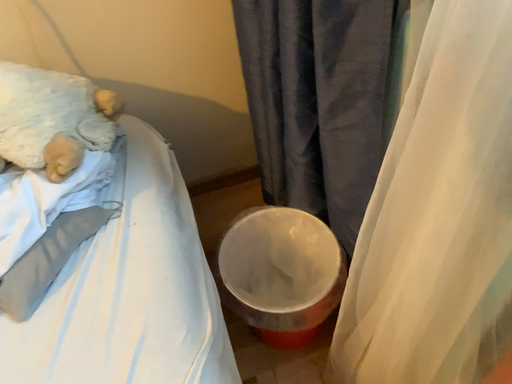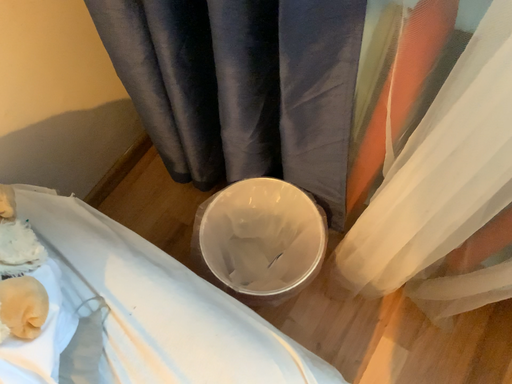
Question: How did the camera likely rotate when shooting the video?

Choices:
 (A) rotated right
 (B) rotated left

Answer: (A)